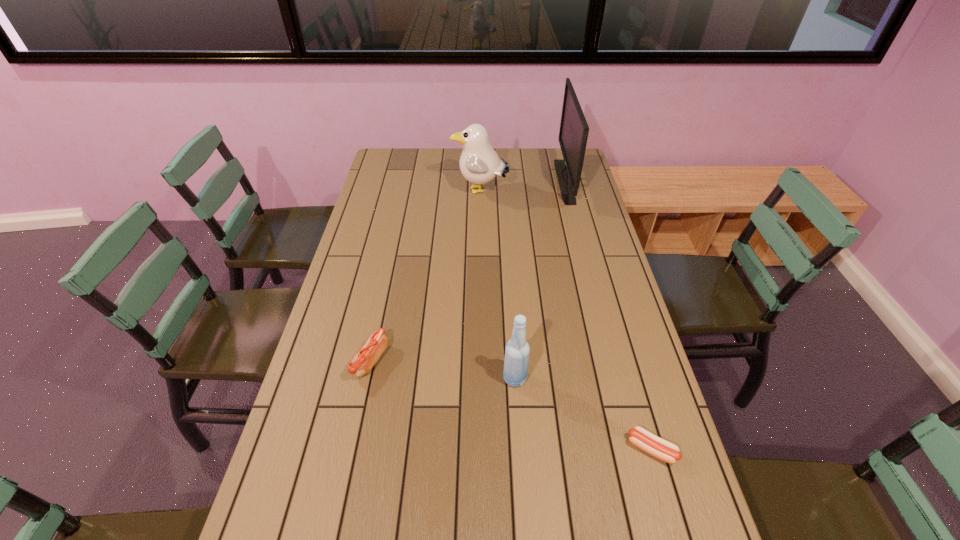
Image resolution: width=960 pixels, height=540 pixels. In order to click on vacant space that is in between the fourth tallest object and the third shortest object in this screenshot , I will do `click(443, 370)`.

Locate an element on the screen. This screenshot has width=960, height=540. unoccupied position between the gull and the second shortest object is located at coordinates (425, 276).

Find the location of a particular element. The image size is (960, 540). vacant space that is in between the farther sausage and the shortest object is located at coordinates (512, 405).

You are a GUI agent. You are given a task and a screenshot of the screen. Output one action in this format:
    pyautogui.click(x=<x>, y=<y>)
    Task: Click on the object that can be found as the third closest to the gull
    The image size is (960, 540).
    Given the screenshot: What is the action you would take?
    pyautogui.click(x=516, y=362)

Image resolution: width=960 pixels, height=540 pixels. In order to click on the fourth closest object to the right sausage in this screenshot , I will do `click(479, 163)`.

Select which sausage appears as the second closest to the gull. Please provide its 2D coordinates. Your answer should be formatted as a tuple, i.e. [(x, y)], where the tuple contains the x and y coordinates of a point satisfying the conditions above.

[(662, 449)]

Find the location of a particular element. This screenshot has height=540, width=960. free location that satisfies the following two spatial constraints: 1. on the beak of the gull; 2. on the back side of the bottle is located at coordinates click(480, 378).

Where is `free space that satisfies the following two spatial constraints: 1. on the back side of the nearer sausage; 2. on the beak of the gull`? This screenshot has height=540, width=960. free space that satisfies the following two spatial constraints: 1. on the back side of the nearer sausage; 2. on the beak of the gull is located at coordinates (578, 192).

You are a GUI agent. You are given a task and a screenshot of the screen. Output one action in this format:
    pyautogui.click(x=<x>, y=<y>)
    Task: Click on the free location that satisfies the following two spatial constraints: 1. on the back side of the shorter sausage; 2. on the beak of the fourth shortest object
    The image size is (960, 540).
    Given the screenshot: What is the action you would take?
    pyautogui.click(x=578, y=192)

Locate an element on the screen. This screenshot has width=960, height=540. blank area in the image that satisfies the following two spatial constraints: 1. on the front-facing side of the monitor; 2. on the left side of the shorter sausage is located at coordinates (633, 449).